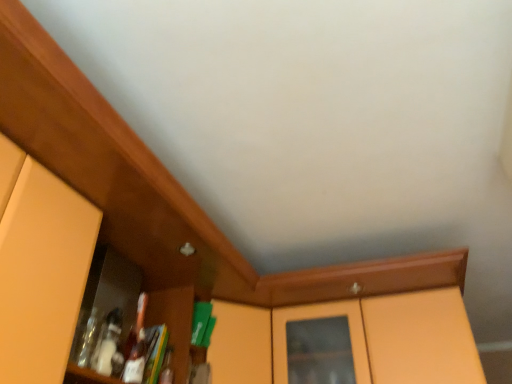
Question: Is matte orange cabinet at left bigger than matte orange cabinet at center?

Choices:
 (A) yes
 (B) no

Answer: (B)

Question: From a real-world perspective, does matte orange cabinet at left stand above matte orange cabinet at center?

Choices:
 (A) yes
 (B) no

Answer: (B)

Question: Can you confirm if matte orange cabinet at left is positioned to the left of matte orange cabinet at center?

Choices:
 (A) yes
 (B) no

Answer: (A)

Question: Does matte orange cabinet at left have a lesser width compared to matte orange cabinet at center?

Choices:
 (A) yes
 (B) no

Answer: (A)

Question: Could you tell me if matte orange cabinet at left is facing matte orange cabinet at center?

Choices:
 (A) yes
 (B) no

Answer: (B)

Question: Is matte orange cabinet at left situated inside matte orange cabinet at center or outside?

Choices:
 (A) inside
 (B) outside

Answer: (B)

Question: Is matte orange cabinet at left in front of or behind matte orange cabinet at center in the image?

Choices:
 (A) front
 (B) behind

Answer: (A)

Question: Is matte orange cabinet at left wider or thinner than matte orange cabinet at center?

Choices:
 (A) wide
 (B) thin

Answer: (B)

Question: Considering the positions of matte orange cabinet at left and matte orange cabinet at center in the image, is matte orange cabinet at left bigger or smaller than matte orange cabinet at center?

Choices:
 (A) small
 (B) big

Answer: (A)

Question: Considering the positions of matte orange cabinet at center and matte orange cabinet at left in the image, is matte orange cabinet at center wider or thinner than matte orange cabinet at left?

Choices:
 (A) wide
 (B) thin

Answer: (A)

Question: Would you say matte orange cabinet at center is inside or outside matte orange cabinet at left?

Choices:
 (A) outside
 (B) inside

Answer: (A)

Question: Does point (214, 372) appear closer or farther from the camera than point (70, 210)?

Choices:
 (A) farther
 (B) closer

Answer: (A)

Question: From a real-world perspective, is matte orange cabinet at center physically located above or below matte orange cabinet at left?

Choices:
 (A) above
 (B) below

Answer: (A)

Question: Based on their sizes in the image, would you say matte orange cabinet at left is bigger or smaller than matte orange cabinet at left?

Choices:
 (A) big
 (B) small

Answer: (A)

Question: In terms of height, does matte orange cabinet at left look taller or shorter compared to matte orange cabinet at left?

Choices:
 (A) short
 (B) tall

Answer: (A)